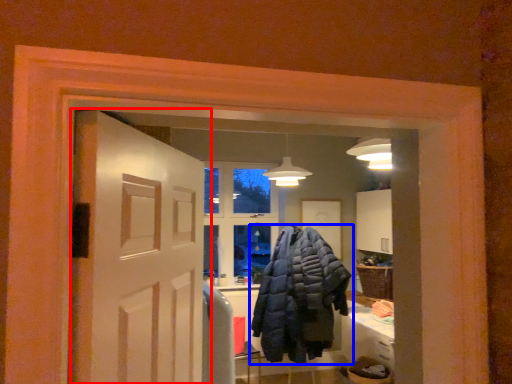
Question: Which point is further to the camera, door (highlighted by a red box) or jacket (highlighted by a blue box)?

Choices:
 (A) door
 (B) jacket

Answer: (B)